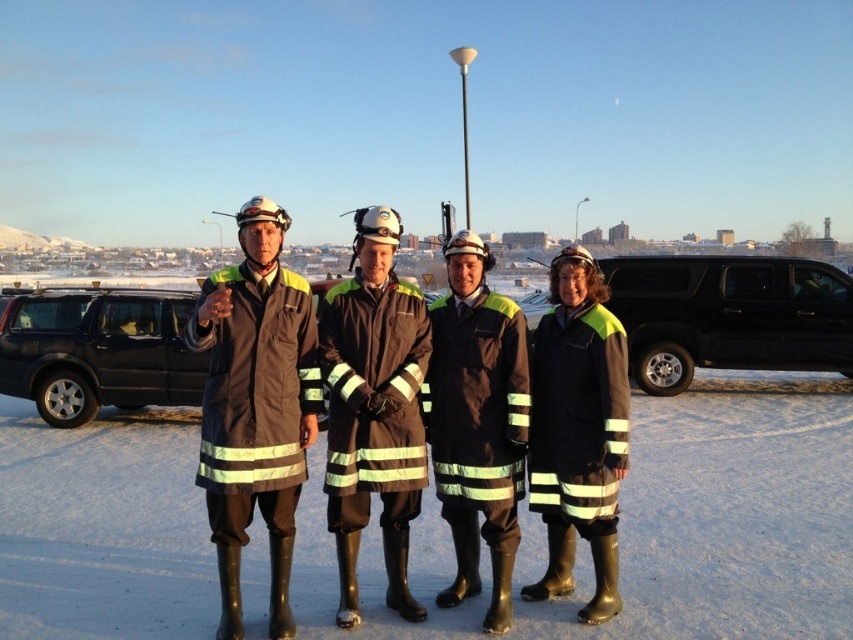
You are planning to take a photo of the dark gray fabric coat at left and the black matte suv at left. Which object should you focus on first if you want to capture both in the frame without moving the camera?

You should focus on the dark gray fabric coat at left first because it occupies less space than the black matte suv at left, so it will be easier to fit both into the frame by starting with the smaller object.

You are a photographer trying to capture the scene with the black fabric uniform at center and the black matte suv at left. Based on their positions, which object is closer to the camera?

The black fabric uniform at center is closer to the camera because it is located below the black matte suv at left, indicating it is in front of the SUV in the scene.